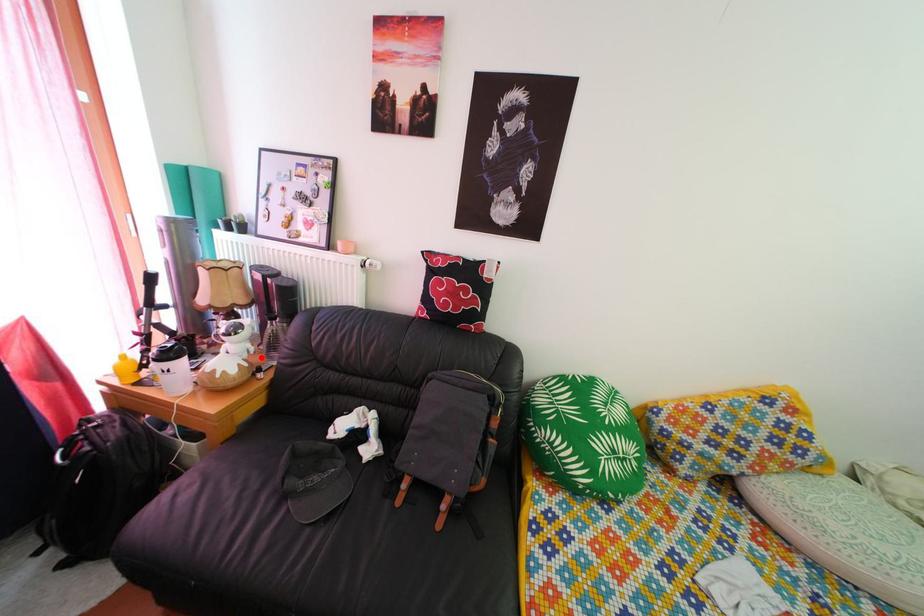
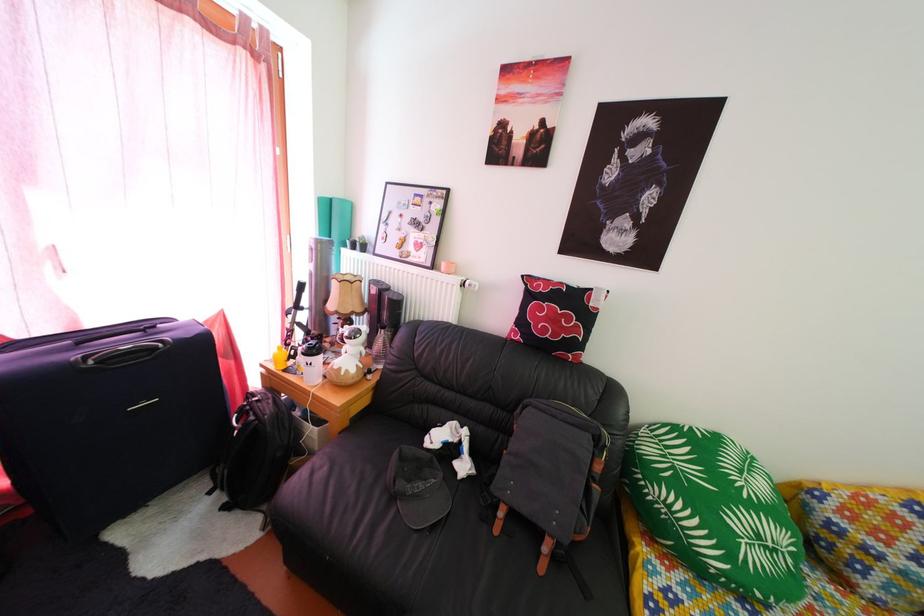
Question: I am providing you with two images of the same scene from different viewpoints. A red point is marked on the first image. At the location where the point appears in image 1, is it still visible in image 2?

Choices:
 (A) Yes
 (B) No

Answer: (A)